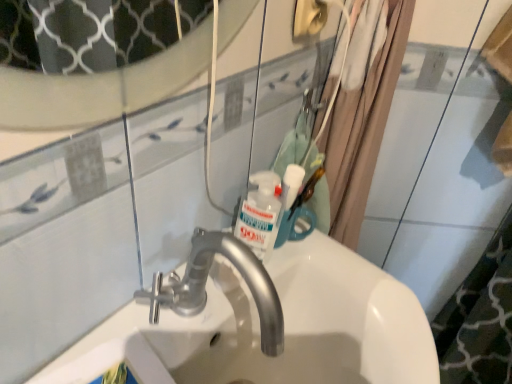
Question: Can you confirm if white glossy mouthwash at upper center is positioned to the left of beige fabric shower curtain at upper right?

Choices:
 (A) yes
 (B) no

Answer: (A)

Question: Does white glossy mouthwash at upper center turn towards beige fabric shower curtain at upper right?

Choices:
 (A) yes
 (B) no

Answer: (B)

Question: From a real-world perspective, is white glossy mouthwash at upper center positioned over beige fabric shower curtain at upper right based on gravity?

Choices:
 (A) yes
 (B) no

Answer: (B)

Question: Is white glossy mouthwash at upper center in front of beige fabric shower curtain at upper right?

Choices:
 (A) no
 (B) yes

Answer: (A)

Question: From a real-world perspective, does white glossy mouthwash at upper center sit lower than beige fabric shower curtain at upper right?

Choices:
 (A) yes
 (B) no

Answer: (A)

Question: In terms of size, does beige fabric shower curtain at upper right appear bigger or smaller than white glossy mouthwash at upper center?

Choices:
 (A) small
 (B) big

Answer: (B)

Question: From a real-world perspective, is beige fabric shower curtain at upper right physically located above or below white glossy mouthwash at upper center?

Choices:
 (A) below
 (B) above

Answer: (B)

Question: Do you think beige fabric shower curtain at upper right is within white glossy mouthwash at upper center, or outside of it?

Choices:
 (A) inside
 (B) outside

Answer: (B)

Question: From their relative heights in the image, would you say beige fabric shower curtain at upper right is taller or shorter than white glossy mouthwash at upper center?

Choices:
 (A) tall
 (B) short

Answer: (A)

Question: Choose the correct answer: Is white glossy sink at center inside white glossy mouthwash at upper center or outside it?

Choices:
 (A) outside
 (B) inside

Answer: (A)

Question: Is white glossy sink at center to the left or to the right of white glossy mouthwash at upper center in the image?

Choices:
 (A) left
 (B) right

Answer: (A)

Question: Based on their sizes in the image, would you say white glossy sink at center is bigger or smaller than white glossy mouthwash at upper center?

Choices:
 (A) big
 (B) small

Answer: (A)

Question: In terms of width, does white glossy sink at center look wider or thinner when compared to white glossy mouthwash at upper center?

Choices:
 (A) thin
 (B) wide

Answer: (B)

Question: Considering the relative positions of white glossy sink at center and beige fabric shower curtain at upper right in the image provided, is white glossy sink at center to the left or to the right of beige fabric shower curtain at upper right?

Choices:
 (A) left
 (B) right

Answer: (A)

Question: Considering the positions of white glossy sink at center and beige fabric shower curtain at upper right in the image, is white glossy sink at center wider or thinner than beige fabric shower curtain at upper right?

Choices:
 (A) thin
 (B) wide

Answer: (B)